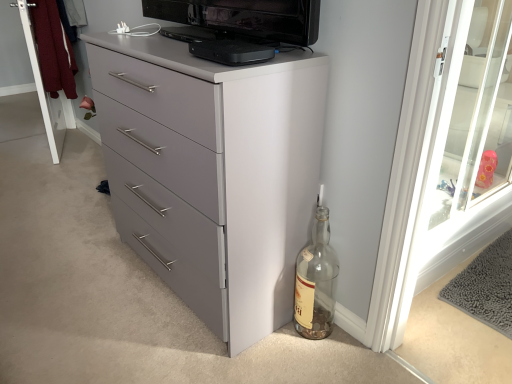
At what (x,y) coordinates should I click in order to perform the action: click on vacant area that lies in front of clear glass bottle at lower right. Please return your answer as a coordinate pair (x, y). Looking at the image, I should click on (315, 360).